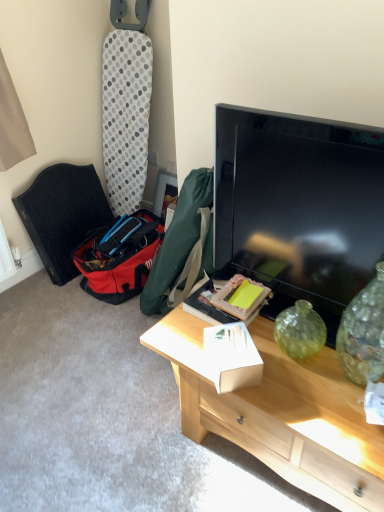
Question: Considering the positions of flat screen tv at center and black fabric folding chair at left in the image, is flat screen tv at center taller or shorter than black fabric folding chair at left?

Choices:
 (A) short
 (B) tall

Answer: (A)

Question: Is point (339, 309) positioned closer to the camera than point (51, 261)?

Choices:
 (A) farther
 (B) closer

Answer: (B)

Question: Which object is positioned farthest from the black fabric folding chair at left?

Choices:
 (A) flat screen tv at center
 (B) light wood desk at center
 (C) white cardboard box at center, arranged as the first box when viewed from the front
 (D) white cardboard box at center, acting as the second box starting from the front
 (E) wooden picture frame at center

Answer: (C)

Question: Which is farther from the wooden picture frame at center?

Choices:
 (A) white cardboard box at center, arranged as the first box when viewed from the front
 (B) black fabric folding chair at left
 (C) flat screen tv at center
 (D) light wood desk at center
 (E) white cardboard box at center, acting as the second box starting from the front

Answer: (D)